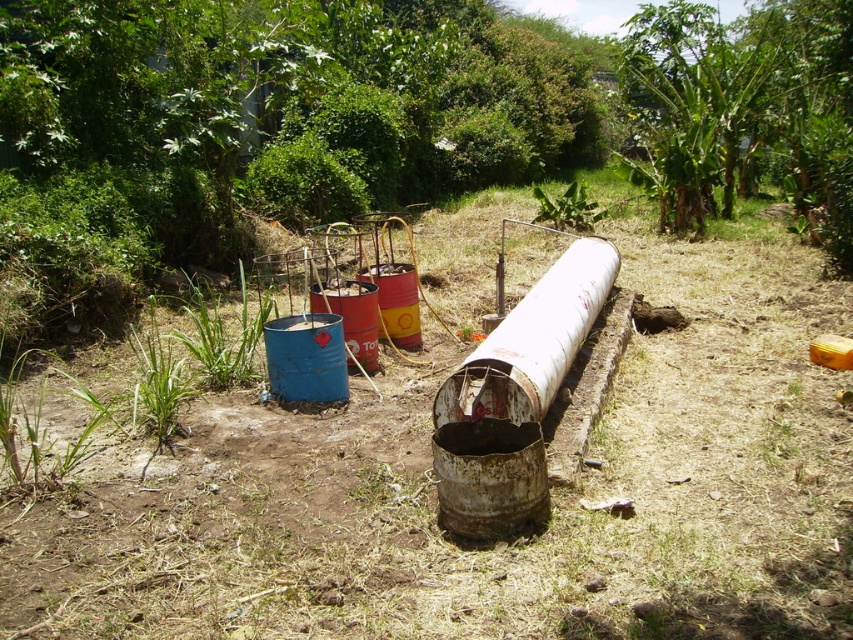
You are standing near the large white cylindrical pipe and want to place a small flag at each of the two points labeled point (697, 250) and point (241, 268). Which point should you place the flag closer to you?

You should place the flag at point (697, 250) because it is closer to you than point (241, 268).

You are a gardener who wants to plant flowers in the area with the most lush green grass. Based on the image, which location should you choose between the green grass at center and the green grass at lower left?

The green grass at lower left has a larger size compared to the green grass at center, so you should choose the green grass at lower left for planting flowers.

You are a gardener who wants to plant flowers in the area with the thickest green grass. Based on the image, which location should you choose between the green grass at center and green grass at lower left?

The green grass at lower left is thicker than the green grass at center, so you should choose the green grass at lower left to plant flowers.